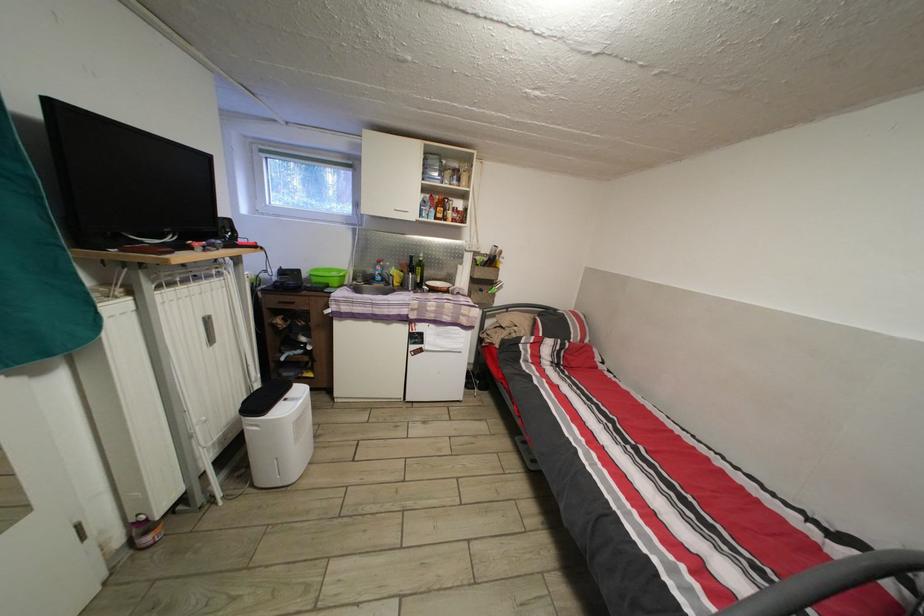
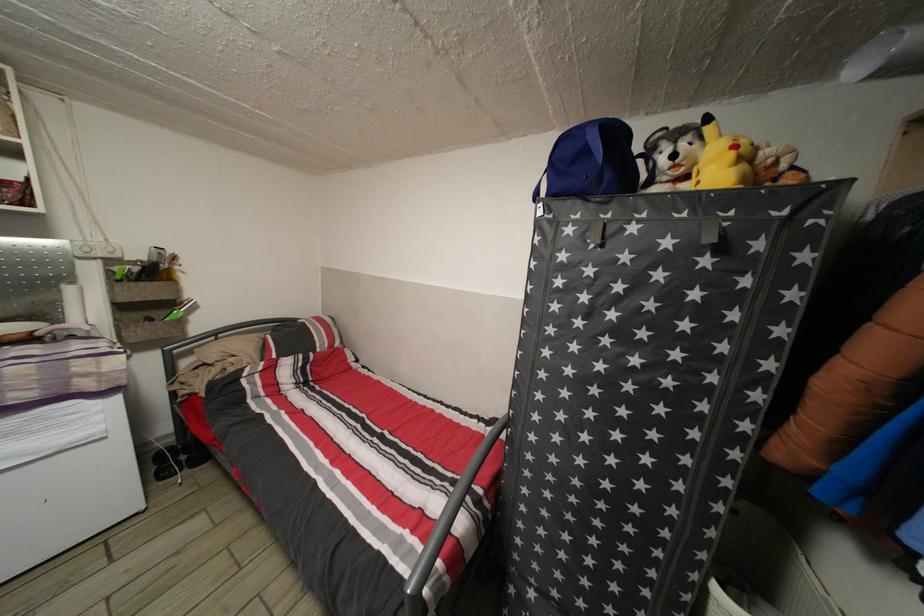
In the second image, find the point that corresponds to point (480, 286) in the first image.

(128, 314)